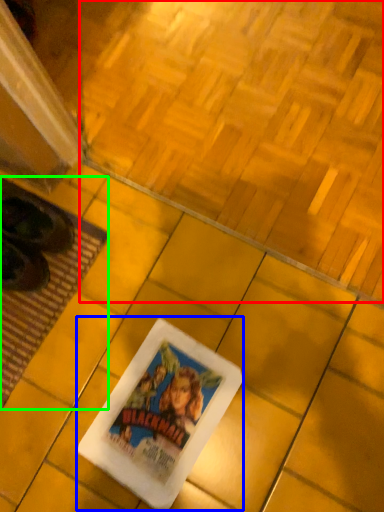
Question: Which object is positioned farthest from square (highlighted by a red box)? Select from movie poster (highlighted by a blue box) and mat (highlighted by a green box).

Choices:
 (A) movie poster
 (B) mat

Answer: (A)